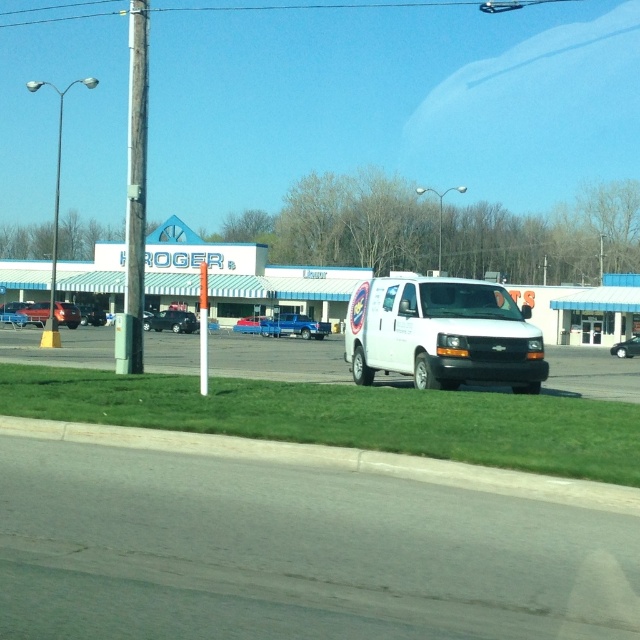
You are standing at the point labeled point (67, 314). Which object are you at?

You are at the metallic red car at center.